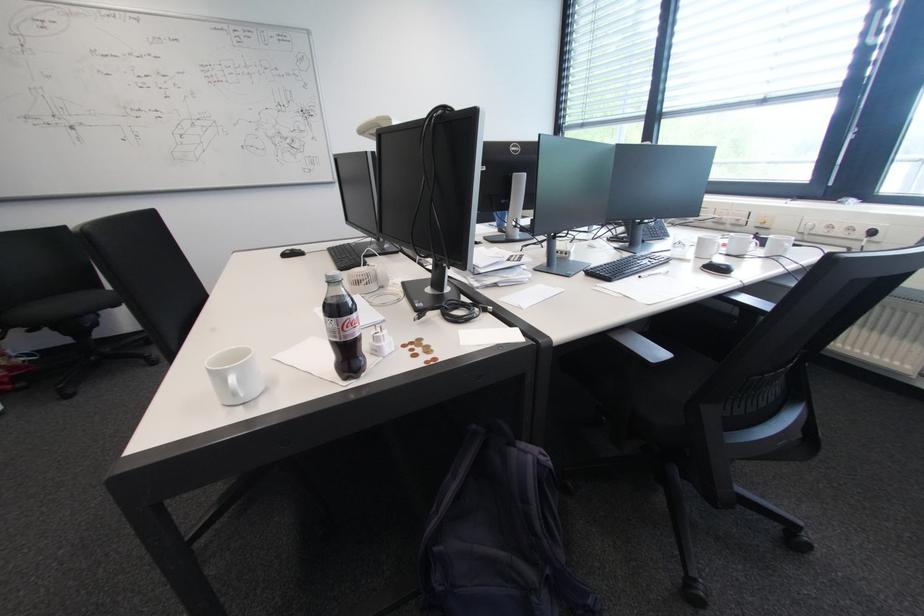
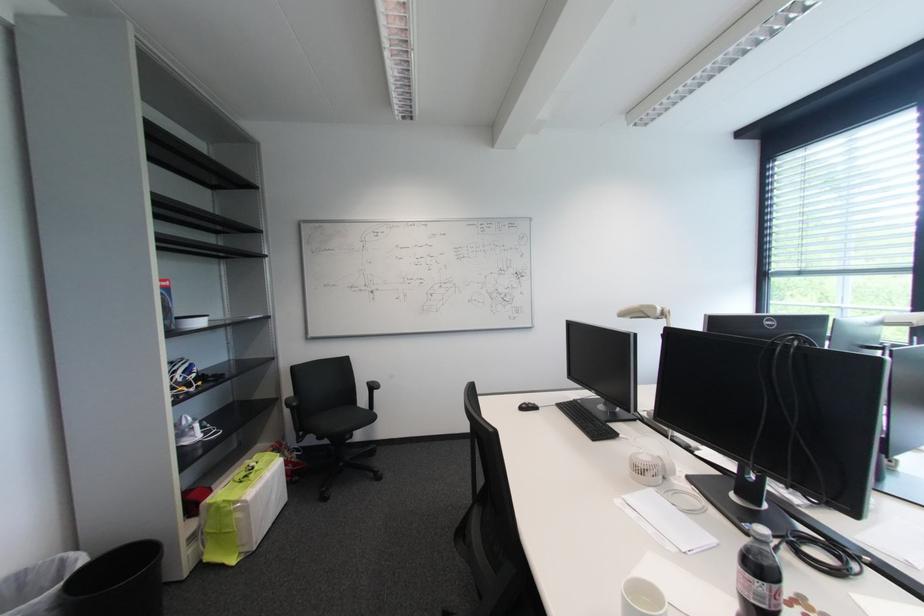
Where in the second image is the point corresponding to point (295, 254) from the first image?

(530, 408)